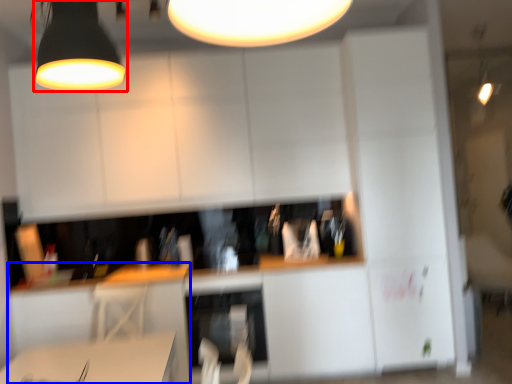
Question: Which point is further to the camera, lamp (highlighted by a red box) or computer desk (highlighted by a blue box)?

Choices:
 (A) lamp
 (B) computer desk

Answer: (B)